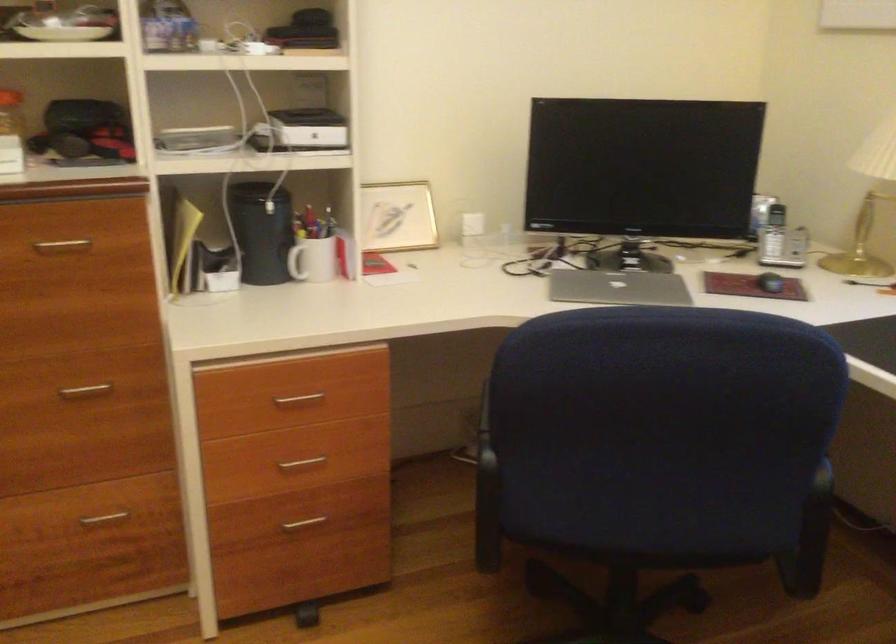
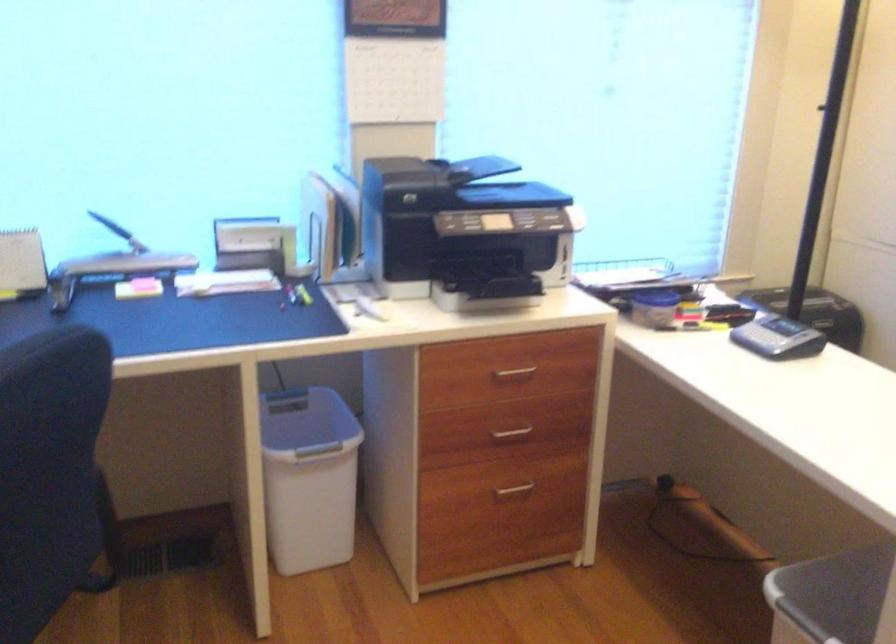
Locate, in the second image, the point that corresponds to pixel 721 420 in the first image.

(48, 471)